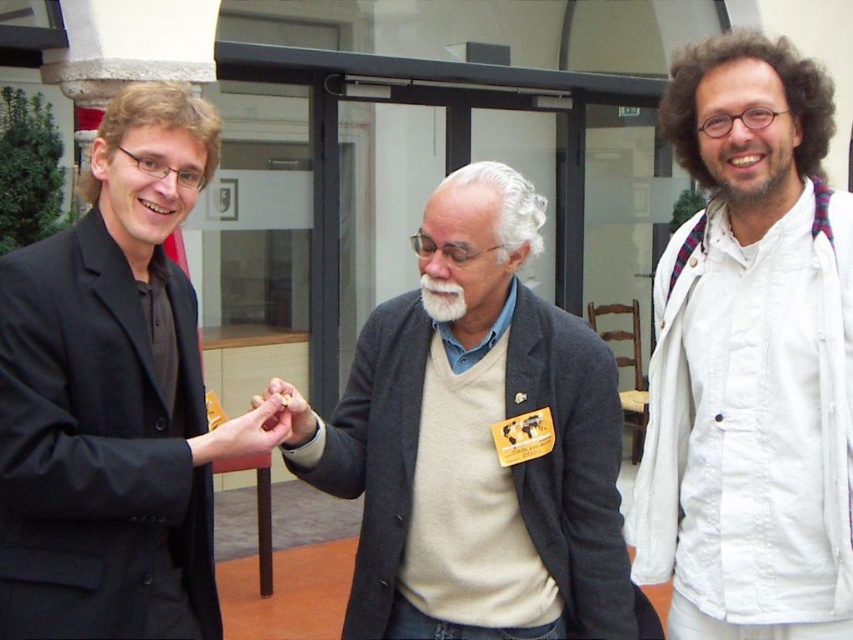
You are a photographer positioned in front of the modern building. You want to take a photo of the beige sweater at center and the black matte suit at left. Which person should you adjust to be closer to the camera to ensure both are in focus?

The black matte suit at left is behind the beige sweater at center, so you should move the black matte suit at left closer to the camera to ensure both are in focus.

You are standing at the entrance of the building and notice two points marked on the ground. The first point is located at coordinates point (498, 509) and the second at point (67, 554). If you were to walk from the first point to the second, would you be moving forward or backward relative to the building entrance?

Since point (498, 509) is behind point (67, 554), moving from the first to the second point would mean moving forward towards the building entrance.